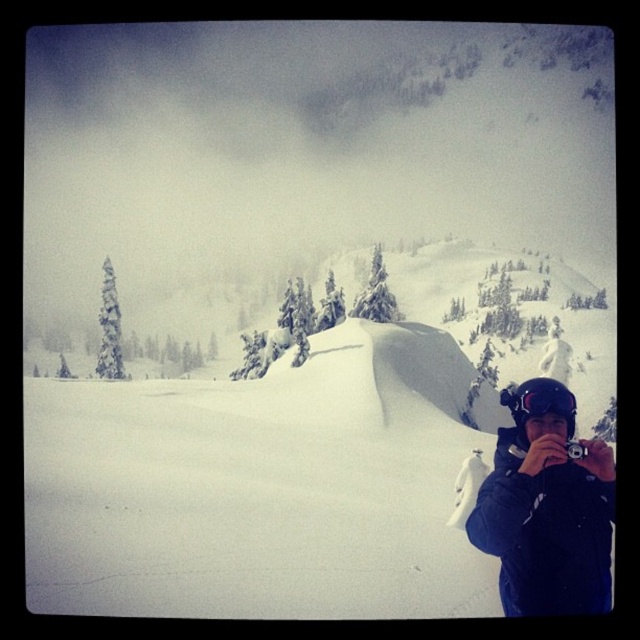
In the scene shown: Who is higher up, white fluffy snow at center or black matte goggles at lower right?

white fluffy snow at center is above.

Can you confirm if white fluffy snow at center is wider than black matte goggles at lower right?

Correct, the width of white fluffy snow at center exceeds that of black matte goggles at lower right.

Image resolution: width=640 pixels, height=640 pixels. What do you see at coordinates (262, 486) in the screenshot? I see `white fluffy snow at center` at bounding box center [262, 486].

You are a GUI agent. You are given a task and a screenshot of the screen. Output one action in this format:
    pyautogui.click(x=<x>, y=<y>)
    Task: Click on the white fluffy snow at center
    Image resolution: width=640 pixels, height=640 pixels.
    Given the screenshot: What is the action you would take?
    pyautogui.click(x=262, y=486)

Which is behind, point (92, 497) or point (584, 452)?

The point (92, 497) is more distant.

Between point (168, 483) and point (570, 456), which one is positioned behind?

Point (168, 483)

Where is `white fluffy snow at center`? The width and height of the screenshot is (640, 640). white fluffy snow at center is located at coordinates (262, 486).

Is white fluffy snow at center to the left of dark blue jacket at lower right from the viewer's perspective?

Correct, you'll find white fluffy snow at center to the left of dark blue jacket at lower right.

Which is in front, point (90, 433) or point (541, 544)?

Point (541, 544) is in front.

Where is `white fluffy snow at center`? Image resolution: width=640 pixels, height=640 pixels. white fluffy snow at center is located at coordinates coord(262,486).